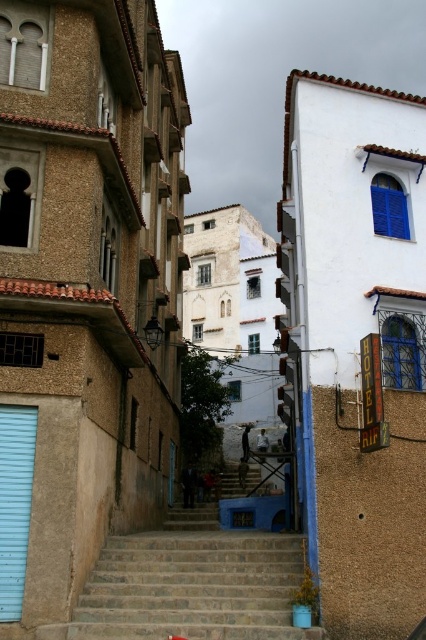
Who is shorter, brown stone stairs at center or light blue matte garage door at lower left?

Standing shorter between the two is brown stone stairs at center.

Is brown stone stairs at center positioned in front of light blue matte garage door at lower left?

That is True.

Identify the location of brown stone stairs at center. The height and width of the screenshot is (640, 426). (190, 582).